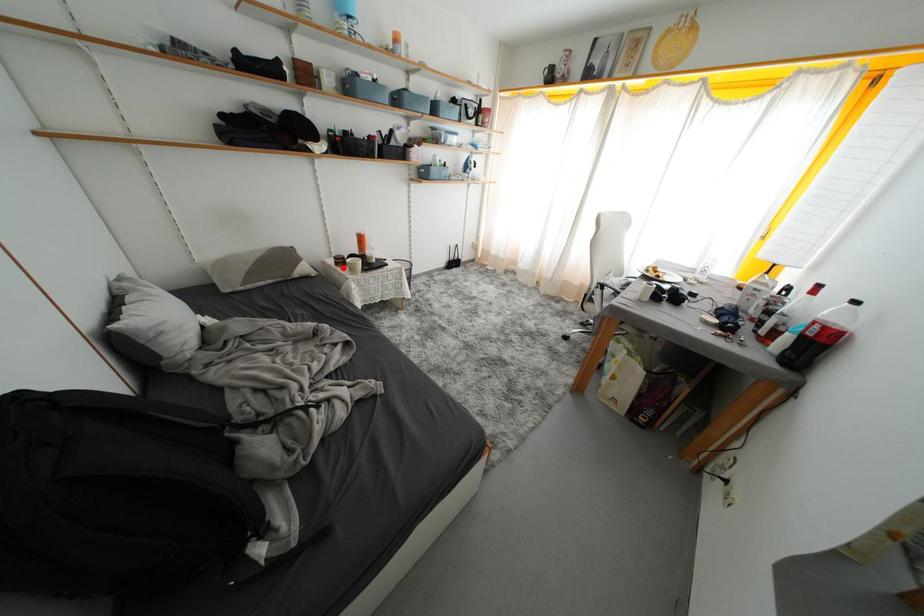
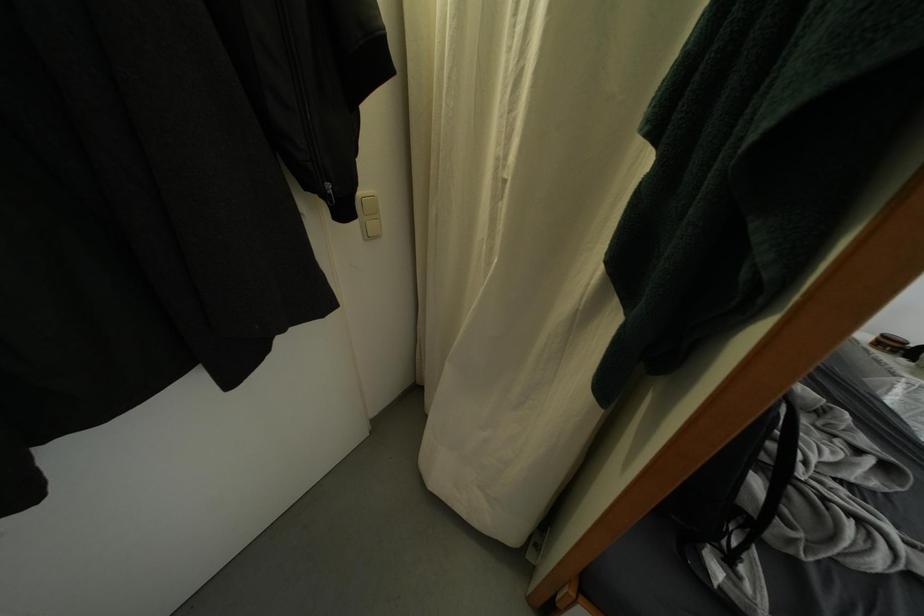
Find the pixel in the second image that matches the highlighted location in the first image.

(884, 347)